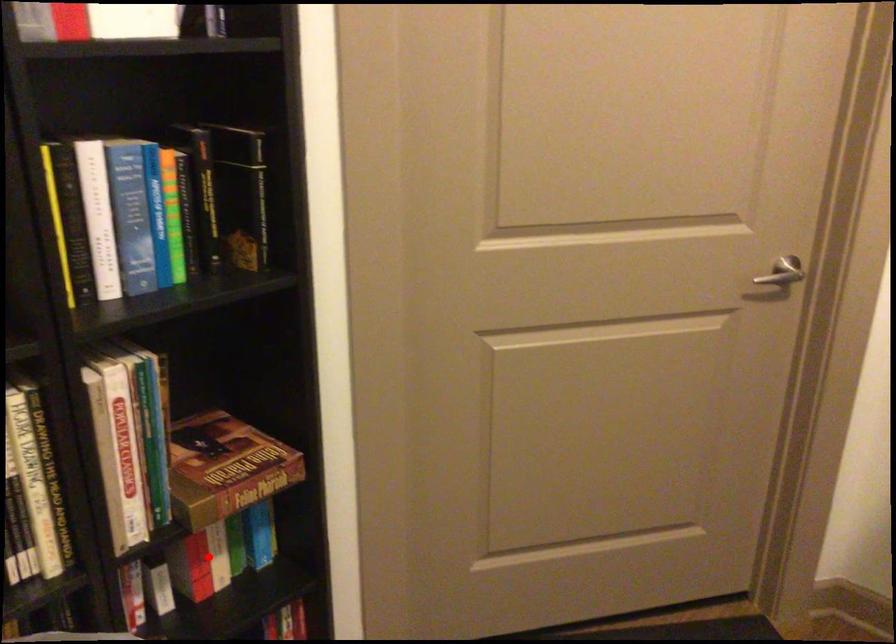
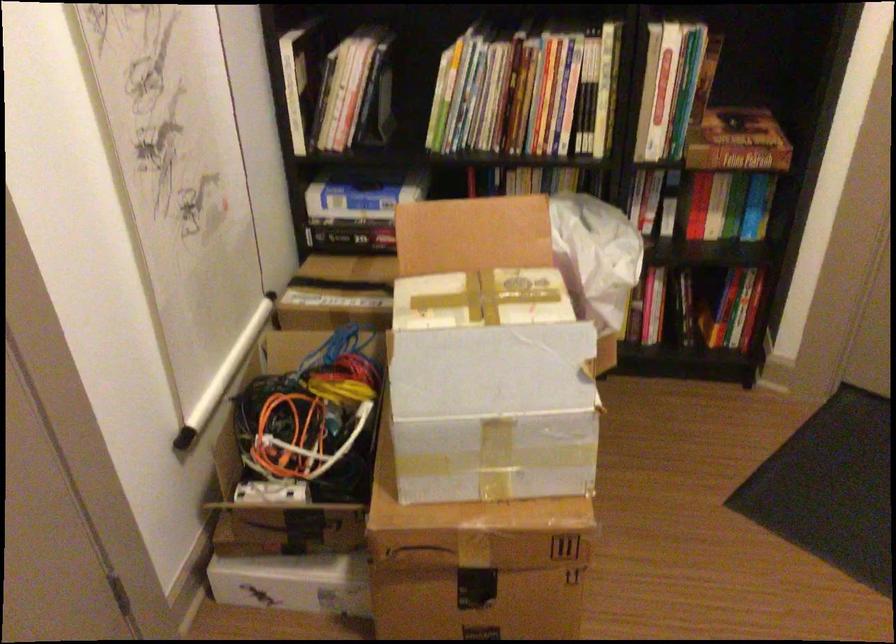
In the second image, find the point that corresponds to the highlighted location in the first image.

(703, 204)